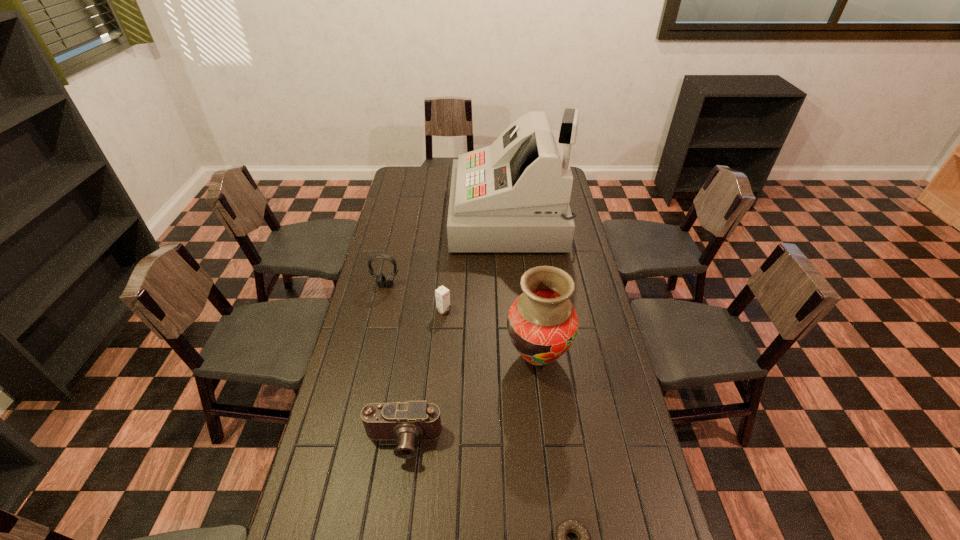
This screenshot has width=960, height=540. Find the location of `vacant position in the image that satisfies the following two spatial constraints: 1. on the keypad side of the farthest object; 2. on the back side of the vase`. vacant position in the image that satisfies the following two spatial constraints: 1. on the keypad side of the farthest object; 2. on the back side of the vase is located at coordinates point(521,356).

You are a GUI agent. You are given a task and a screenshot of the screen. Output one action in this format:
    pyautogui.click(x=<x>, y=<y>)
    Task: Click on the free space that satisfies the following two spatial constraints: 1. on the keypad side of the cash register; 2. on the front-facing side of the fifth farthest object
    
    Given the screenshot: What is the action you would take?
    pyautogui.click(x=528, y=441)

The image size is (960, 540). In order to click on free spot that satisfies the following two spatial constraints: 1. on the keypad side of the cash register; 2. on the front side of the fourth nearest object in this screenshot , I will do `click(517, 310)`.